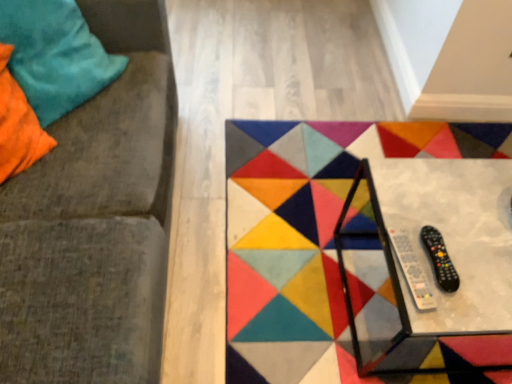
What are the coordinates of `vacant space to the right of black plastic remote control at lower right` in the screenshot? It's located at (479, 257).